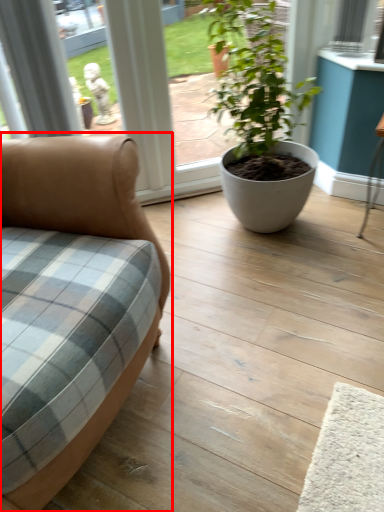
Question: From the image's perspective, what is the correct spatial relationship of studio couch (annotated by the red box) in relation to houseplant?

Choices:
 (A) above
 (B) below

Answer: (B)